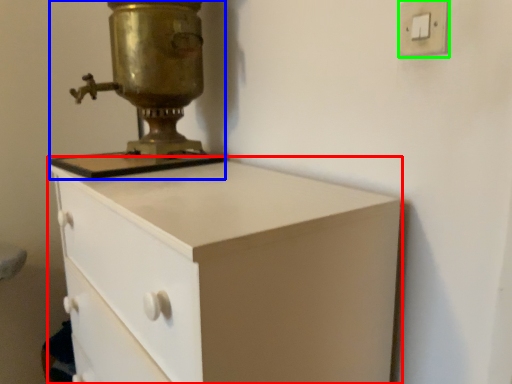
Question: Which object is positioned farthest from chest of drawers (highlighted by a red box)? Select from sewing machine (highlighted by a blue box) and light switch (highlighted by a green box).

Choices:
 (A) sewing machine
 (B) light switch

Answer: (B)